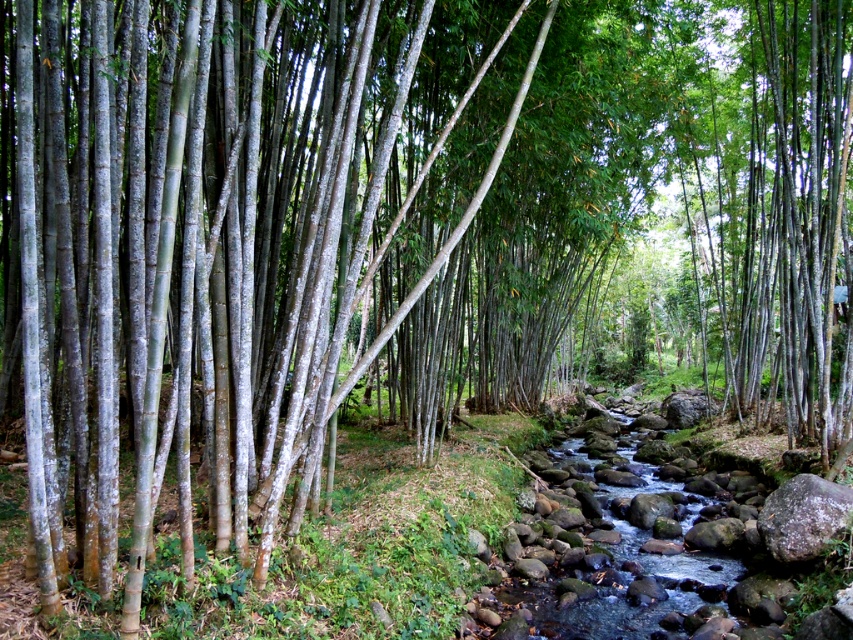
Between point (604, 468) and point (799, 557), which one is positioned in front?

Point (799, 557) is more forward.

What do you see at coordinates (621, 541) in the screenshot?
I see `smooth gray rocks at center` at bounding box center [621, 541].

Identify the location of smooth gray rocks at center. (621, 541).

Where is `smooth gray rocks at center`? The height and width of the screenshot is (640, 853). smooth gray rocks at center is located at coordinates (621, 541).